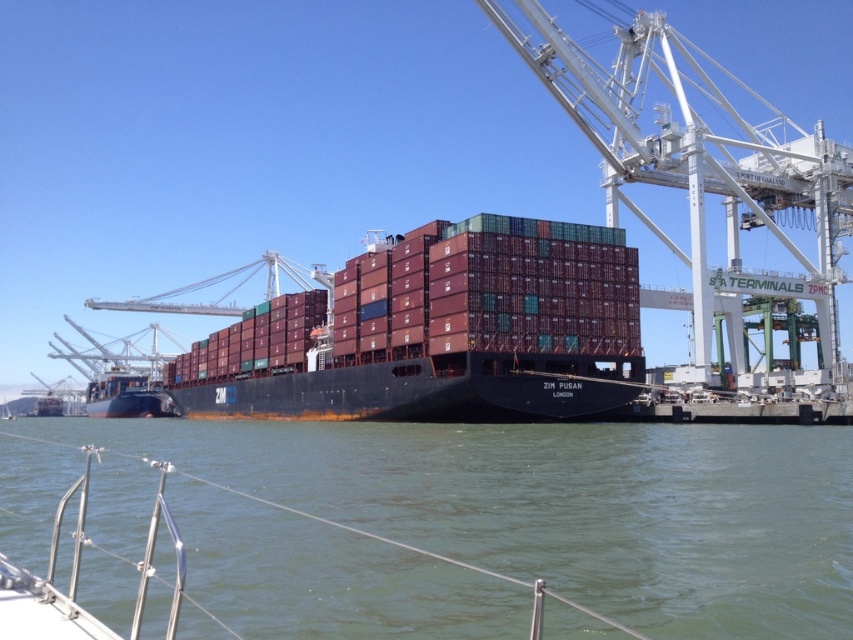
Question: Is greenish water at lower center bigger than white metal crane at upper right?

Choices:
 (A) no
 (B) yes

Answer: (A)

Question: Can you confirm if maroon matte container ship at center is bigger than white metal crane at upper right?

Choices:
 (A) no
 (B) yes

Answer: (A)

Question: Which of the following is the closest to the observer?

Choices:
 (A) maroon matte container ship at center
 (B) white metal crane at upper right
 (C) greenish water at lower center

Answer: (C)

Question: Which of the following is the farthest from the observer?

Choices:
 (A) (543, 45)
 (B) (525, 236)

Answer: (A)

Question: Which point is farther to the camera?

Choices:
 (A) greenish water at lower center
 (B) maroon matte container ship at center
 (C) white metal crane at upper right

Answer: (C)

Question: Where is greenish water at lower center located in relation to maroon matte container ship at center in the image?

Choices:
 (A) below
 (B) above

Answer: (A)